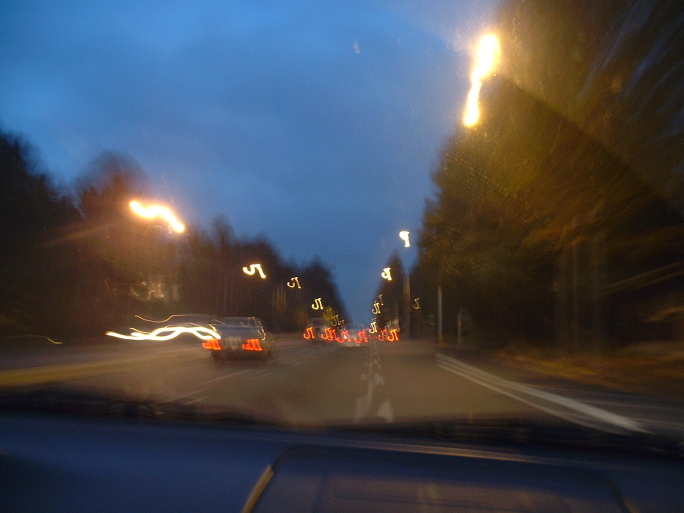
Where is `red lights`? red lights is located at coordinates (213, 345), (252, 343).